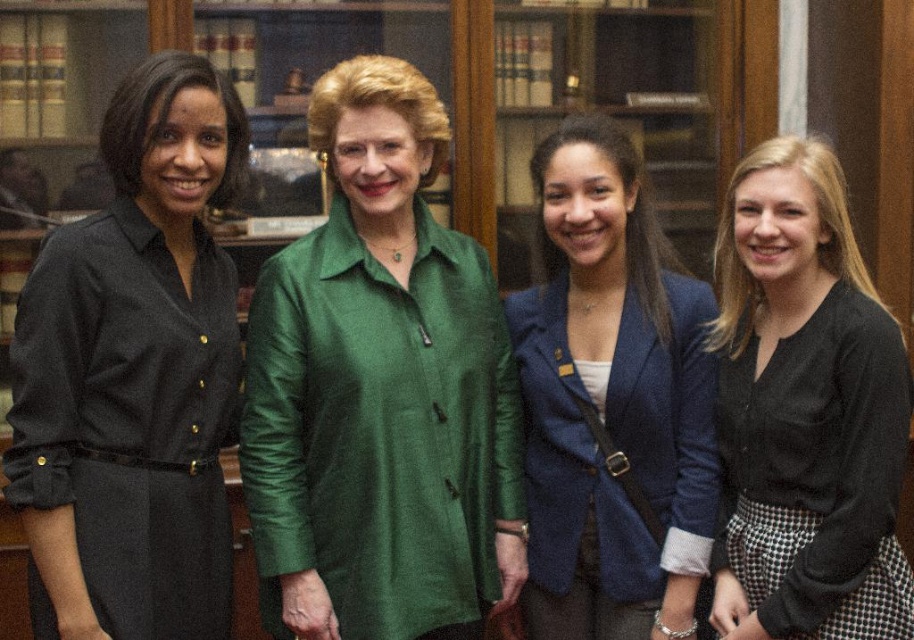
Question: Among these objects, which one is nearest to the camera?

Choices:
 (A) green silk blouse at center
 (B) blue textured blazer at center
 (C) black matte sweater at right
 (D) black dress at left

Answer: (D)

Question: Which point is farther to the camera?

Choices:
 (A) black dress at left
 (B) green silk blouse at center
 (C) blue textured blazer at center

Answer: (C)

Question: Which point is farther to the camera?

Choices:
 (A) (388, 468)
 (B) (193, 294)
 (C) (741, 189)

Answer: (C)

Question: Is black dress at left further to camera compared to blue textured blazer at center?

Choices:
 (A) no
 (B) yes

Answer: (A)

Question: From the image, what is the correct spatial relationship of blue textured blazer at center in relation to black matte sweater at right?

Choices:
 (A) below
 (B) above

Answer: (B)

Question: Is green silk blouse at center to the right of black dress at left from the viewer's perspective?

Choices:
 (A) yes
 (B) no

Answer: (A)